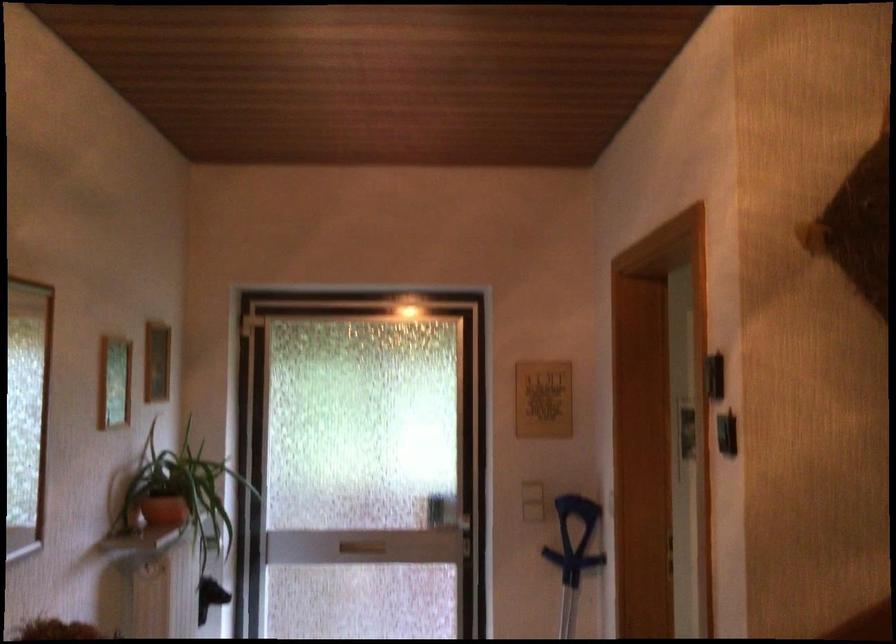
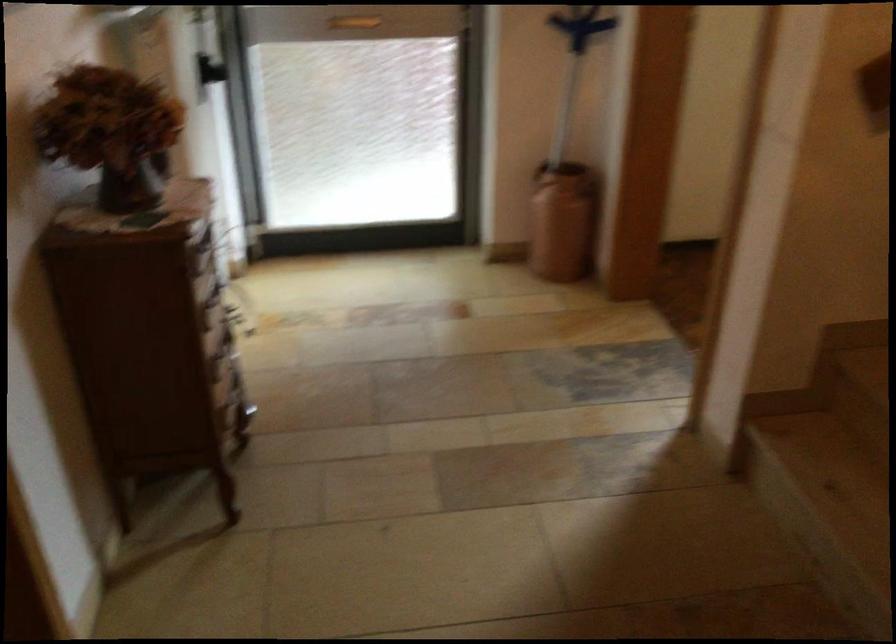
Question: How did the camera likely rotate?

Choices:
 (A) Left
 (B) Right
 (C) Up
 (D) Down

Answer: (D)